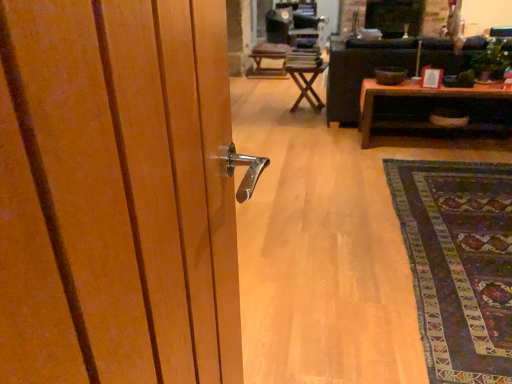
Question: Considering the positions of wooden table at center, which is the 1th table from back to front, and brown wooden table at center, which is the 2th table from left to right, in the image, is wooden table at center, which is the 1th table from back to front, wider or thinner than brown wooden table at center, which is the 2th table from left to right,?

Choices:
 (A) wide
 (B) thin

Answer: (B)

Question: From the image's perspective, is wooden table at center, marked as the first table in a left-to-right arrangement, positioned above or below brown wooden table at center, marked as the first table in a right-to-left arrangement?

Choices:
 (A) above
 (B) below

Answer: (A)

Question: Estimate the real-world distances between objects in this image. Which object is closer to the dark purple woven rug at lower right?

Choices:
 (A) wooden table at center, marked as the first table in a left-to-right arrangement
 (B) black leather couch at center
 (C) brown wooden table at center, marked as the first table in a right-to-left arrangement
 (D) wooden chair at center

Answer: (C)

Question: Estimate the real-world distances between objects in this image. Which object is farther from the wooden chair at center?

Choices:
 (A) dark purple woven rug at lower right
 (B) brown wooden table at center, which is the 2th table from left to right
 (C) black leather couch at center
 (D) wooden table at center, arranged as the 2th table when viewed from the right

Answer: (A)